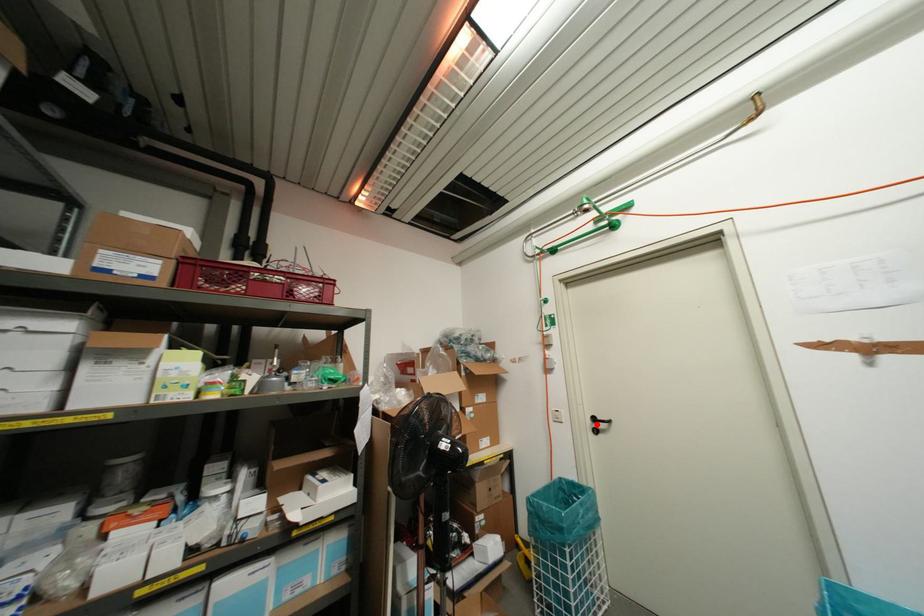
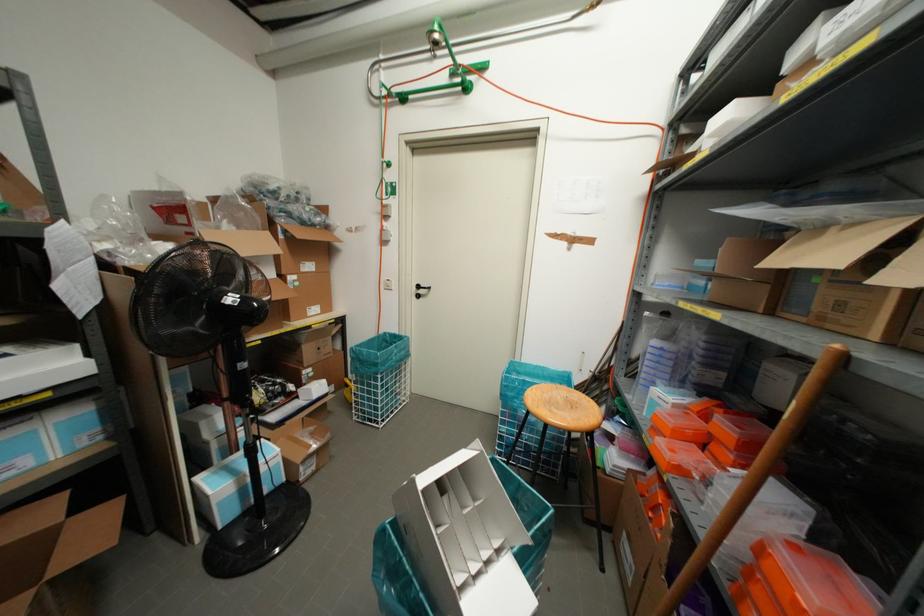
Where in the second image is the point corresponding to the highlighted location from the first image?

(419, 291)